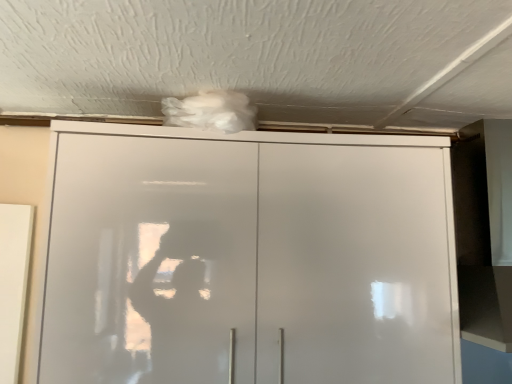
Where is `white glossy cupboard at center`? This screenshot has height=384, width=512. white glossy cupboard at center is located at coordinates (250, 256).

Describe the element at coordinates (250, 256) in the screenshot. I see `white glossy cupboard at center` at that location.

What are the coordinates of `white glossy cupboard at center` in the screenshot? It's located at (250, 256).